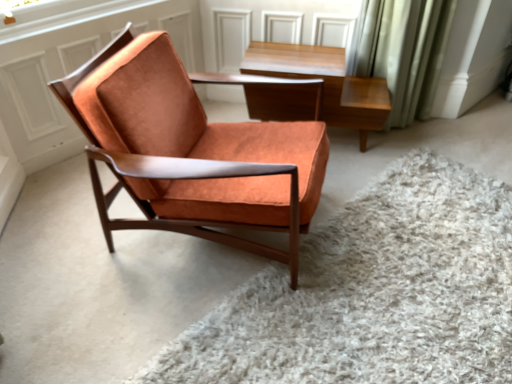
Where is `orange suede chair at center`? This screenshot has height=384, width=512. orange suede chair at center is located at coordinates (373, 293).

Locate an element on the screen. light brown wood table at upper center is located at coordinates (325, 83).

What do you see at coordinates (192, 150) in the screenshot?
I see `suede orange chair at center` at bounding box center [192, 150].

Where is `orange suede chair at center`? orange suede chair at center is located at coordinates (373, 293).

How distant is orange suede chair at center from suede orange chair at center?

They are 20.04 inches apart.

Between orange suede chair at center and suede orange chair at center, which one appears on the left side from the viewer's perspective?

suede orange chair at center is more to the left.

In terms of width, does orange suede chair at center look wider or thinner when compared to suede orange chair at center?

Clearly, orange suede chair at center has more width compared to suede orange chair at center.

Is suede orange chair at center located within orange suede chair at center?

No, orange suede chair at center does not contain suede orange chair at center.

In terms of width, does suede orange chair at center look wider or thinner when compared to orange suede chair at center?

Clearly, suede orange chair at center has less width compared to orange suede chair at center.

From the image's perspective, which one is positioned lower, suede orange chair at center or orange suede chair at center?

orange suede chair at center.

Consider the image. Is suede orange chair at center to the left of orange suede chair at center from the viewer's perspective?

Indeed, suede orange chair at center is positioned on the left side of orange suede chair at center.

From a real-world perspective, relative to suede orange chair at center, is light brown wood table at upper center vertically above or below?

light brown wood table at upper center is situated lower than suede orange chair at center in the real world.

From the picture: Who is taller, light brown wood table at upper center or suede orange chair at center?

Standing taller between the two is suede orange chair at center.

Considering their positions, is light brown wood table at upper center located in front of or behind suede orange chair at center?

light brown wood table at upper center is behind suede orange chair at center.

Does point (312, 52) come behind point (85, 98)?

Yes, it is behind point (85, 98).

From the image's perspective, relative to orange suede chair at center, is light brown wood table at upper center above or below?

light brown wood table at upper center is above orange suede chair at center.

Is light brown wood table at upper center closer to camera compared to orange suede chair at center?

No.

From the picture: Does light brown wood table at upper center have a lesser height compared to orange suede chair at center?

No, light brown wood table at upper center is not shorter than orange suede chair at center.

Which is farther, (394, 378) or (351, 97)?

Point (351, 97)

Which object is more forward, orange suede chair at center or light brown wood table at upper center?

orange suede chair at center is in front.

Is orange suede chair at center situated inside light brown wood table at upper center or outside?

orange suede chair at center is spatially situated outside light brown wood table at upper center.

From the image's perspective, is orange suede chair at center under light brown wood table at upper center?

Correct, orange suede chair at center appears lower than light brown wood table at upper center in the image.

How many degrees apart are the facing directions of suede orange chair at center and light brown wood table at upper center?

They differ by 84.6 degrees in their facing directions.

From a real-world perspective, is suede orange chair at center over light brown wood table at upper center?

Yes, from a real-world perspective, suede orange chair at center is on top of light brown wood table at upper center.

Is suede orange chair at center inside or outside of light brown wood table at upper center?

suede orange chair at center lies outside light brown wood table at upper center.

Measure the distance from suede orange chair at center to light brown wood table at upper center.

A distance of 24.17 inches exists between suede orange chair at center and light brown wood table at upper center.

In order to click on chair that is on the left side of orange suede chair at center in this screenshot , I will do tap(192, 150).

The image size is (512, 384). I want to click on plain directly beneath the suede orange chair at center (from a real-world perspective), so click(373, 293).

When comparing their distances from orange suede chair at center, does suede orange chair at center or light brown wood table at upper center seem further?

Among the two, light brown wood table at upper center is located further to orange suede chair at center.

From the picture: Considering their positions, is light brown wood table at upper center positioned closer to orange suede chair at center than suede orange chair at center?

suede orange chair at center is positioned closer to the anchor orange suede chair at center.

Looking at the image, which one is located closer to light brown wood table at upper center, orange suede chair at center or suede orange chair at center?

The object closer to light brown wood table at upper center is suede orange chair at center.

When comparing their distances from light brown wood table at upper center, does suede orange chair at center or orange suede chair at center seem further?

orange suede chair at center is further to light brown wood table at upper center.

From the image, which object appears to be farther from suede orange chair at center, light brown wood table at upper center or orange suede chair at center?

light brown wood table at upper center is further to suede orange chair at center.

Based on their spatial positions, is orange suede chair at center or light brown wood table at upper center closer to suede orange chair at center?

orange suede chair at center lies closer to suede orange chair at center than the other object.

Locate an element on the screen. The height and width of the screenshot is (384, 512). chair between orange suede chair at center and light brown wood table at upper center from front to back is located at coordinates (192, 150).